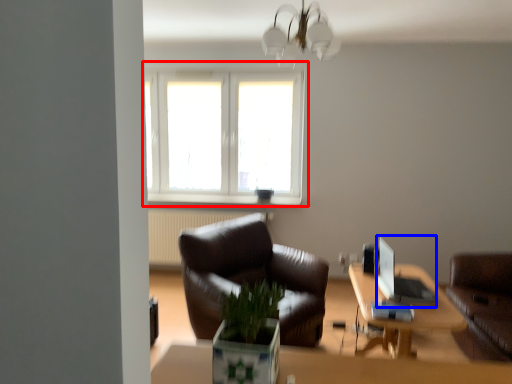
Question: Which of the following is the closest to the observer, window (highlighted by a red box) or computer (highlighted by a blue box)?

Choices:
 (A) window
 (B) computer

Answer: (B)